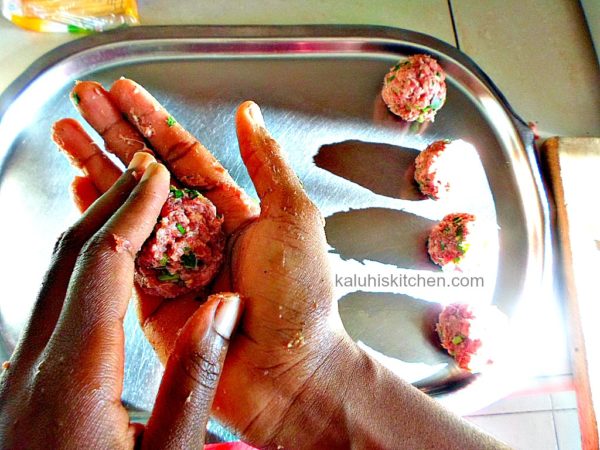
The height and width of the screenshot is (450, 600). Identify the location of black tile line. (455, 19).